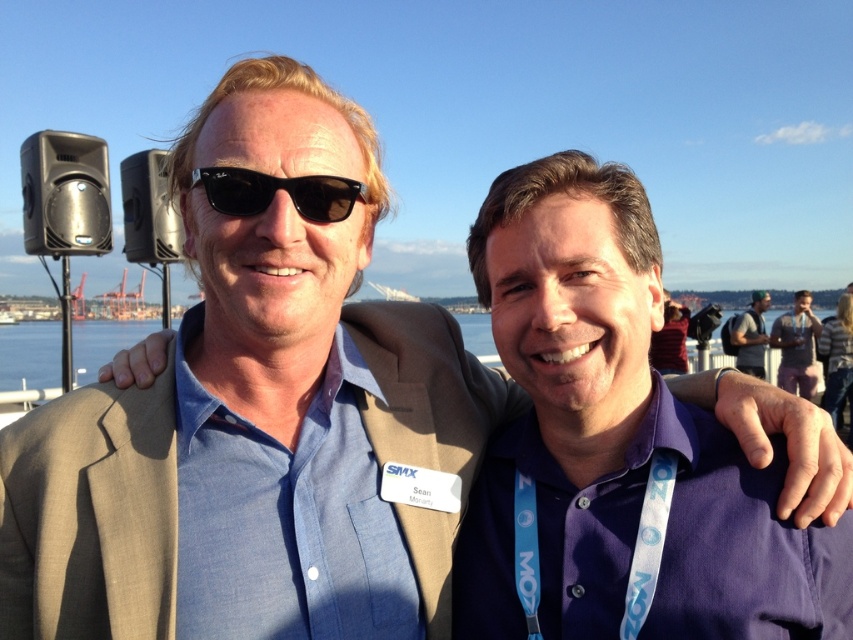
Can you confirm if purple cotton shirt at center is shorter than gray fabric backpack at right?

Correct, purple cotton shirt at center is not as tall as gray fabric backpack at right.

Can you confirm if purple cotton shirt at center is positioned below gray fabric backpack at right?

Yes.

Does point (480, 264) come farther from viewer compared to point (764, 332)?

No.

Identify the location of purple cotton shirt at center. (618, 440).

What are the coordinates of `purple cotton shirt at center` in the screenshot? It's located at (618, 440).

Based on the photo, is purple cotton shirt at center to the left of pink fabric at center from the viewer's perspective?

Indeed, purple cotton shirt at center is positioned on the left side of pink fabric at center.

At what (x,y) coordinates should I click in order to perform the action: click on purple cotton shirt at center. Please return your answer as a coordinate pair (x, y). Looking at the image, I should click on (618, 440).

Is black plastic sunglasses at center below pink fabric at center?

No, black plastic sunglasses at center is not below pink fabric at center.

Which is in front, point (317, 204) or point (786, 314)?

Positioned in front is point (317, 204).

Image resolution: width=853 pixels, height=640 pixels. Describe the element at coordinates (276, 189) in the screenshot. I see `black plastic sunglasses at center` at that location.

The width and height of the screenshot is (853, 640). Identify the location of black plastic sunglasses at center. (276, 189).